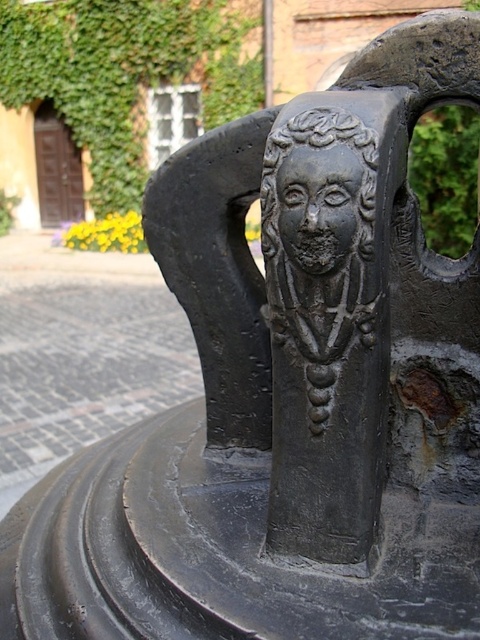
Who is lower down, green ivy at upper left or matte black head at center?

matte black head at center is lower down.

From the picture: Is green ivy at upper left to the left of matte black head at center from the viewer's perspective?

Indeed, green ivy at upper left is positioned on the left side of matte black head at center.

Does point (208, 1) come closer to viewer compared to point (345, 122)?

No, it is behind (345, 122).

You are a GUI agent. You are given a task and a screenshot of the screen. Output one action in this format:
    pyautogui.click(x=<x>, y=<y>)
    Task: Click on the green ivy at upper left
    The height and width of the screenshot is (640, 480).
    Given the screenshot: What is the action you would take?
    pyautogui.click(x=123, y=74)

In the scene shown: Can you confirm if black matte deity at center is bigger than matte black head at center?

Correct, black matte deity at center is larger in size than matte black head at center.

At what (x,y) coordinates should I click in order to perform the action: click on black matte deity at center. Please return your answer as a coordinate pair (x, y). The height and width of the screenshot is (640, 480). Looking at the image, I should click on (328, 317).

Is matte black head at center below black stone face at center?

Incorrect, matte black head at center is not positioned below black stone face at center.

Describe the element at coordinates (319, 193) in the screenshot. I see `matte black head at center` at that location.

Does point (295, 118) come in front of point (292, 160)?

That is False.

Find the location of `matte black head at center`. matte black head at center is located at coordinates click(319, 193).